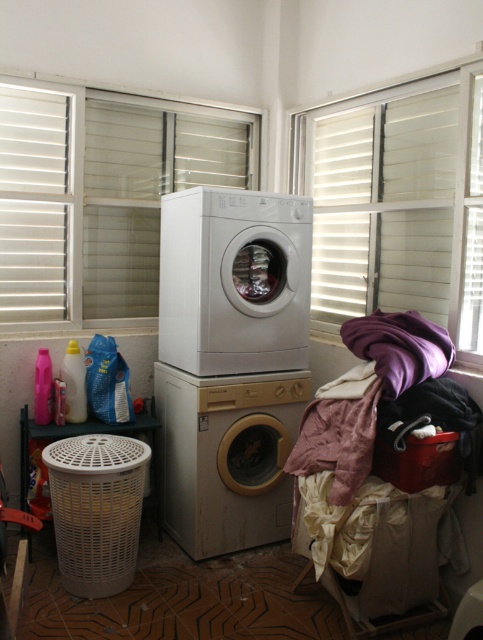
Looking at this image, you are standing in the laundry room and want to open the white wooden window at upper left. Based on its 2D coordinates, which direction should you move to reach it?

The white wooden window at upper left is located at coordinates point (100, 193), which is to the upper left of the room. To reach it, you should move towards the upper left direction from your current position.

You are standing in the laundry room and want to move from the point at coordinates point (188, 108) to the point at coordinates point (347, 348). Can you walk directly between them without any obstacles?

Point (188, 108) is behind point (347, 348), so there is an obstacle blocking the path between them. You cannot walk directly between them without moving around the obstacle.